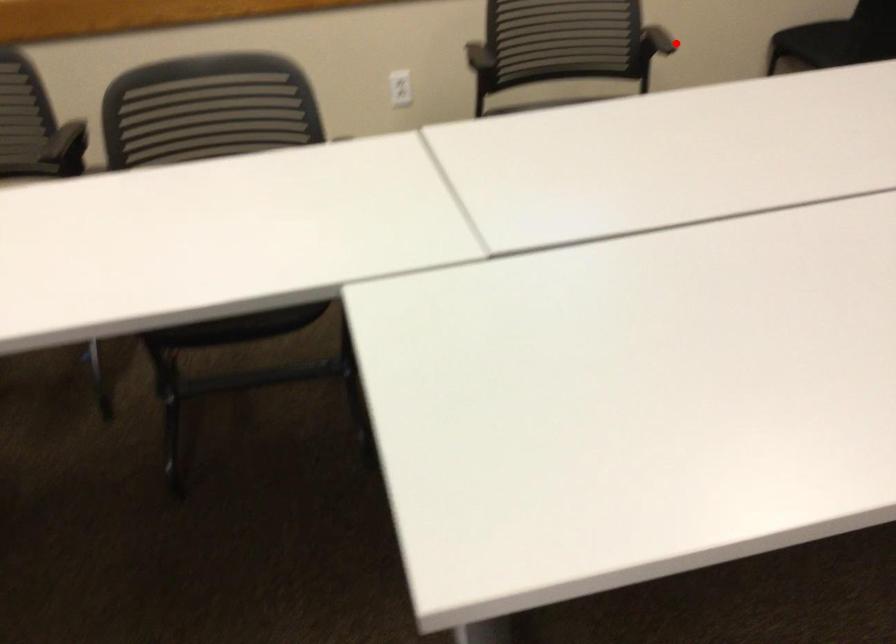
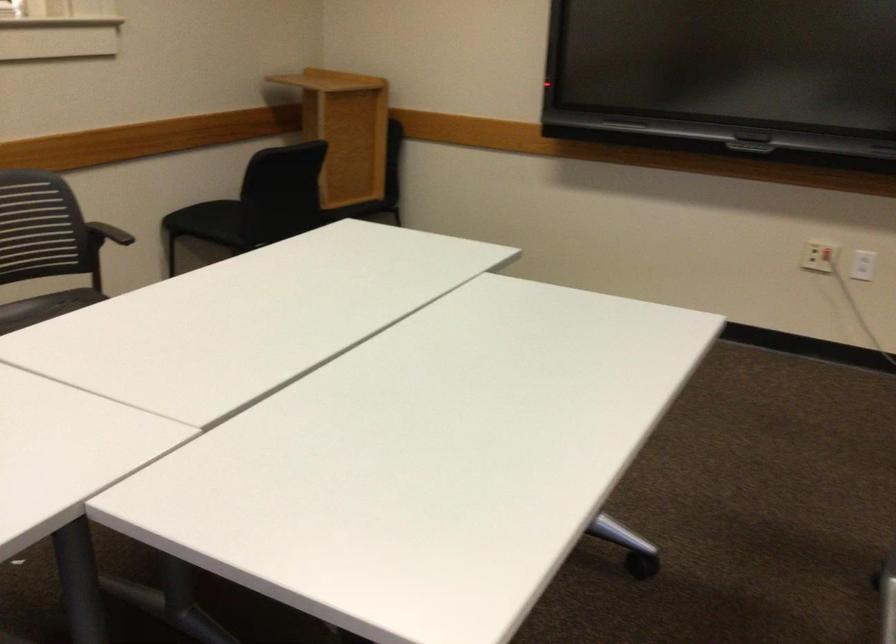
Question: I am providing you with two images of the same scene from different viewpoints. A red point is marked on the first image. Can you still see the location of the red point in image 2?

Choices:
 (A) Yes
 (B) No

Answer: (B)